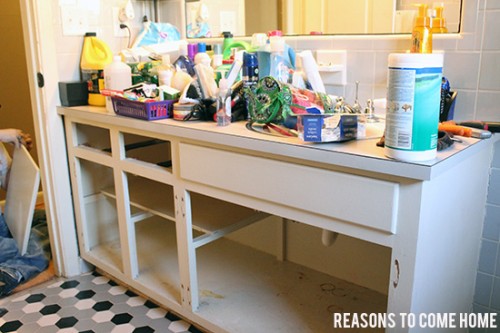
Please find where you'd install  drawers in the image and show me where they are. Your answer should be formatted as a list of tuples, i.e. [(x1, y1), (x2, y2), ...], where each tuple contains the x and y coordinates of a point satisfying the conditions above.

[(102, 145), (162, 150)]